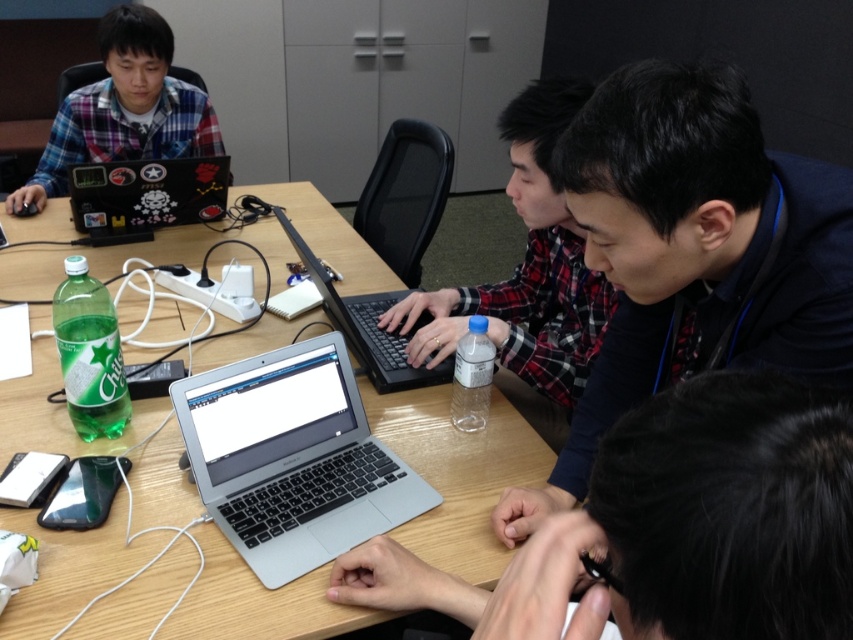
You are sitting at the wooden table at center and want to reach the plaid fabric shirt at center. Is the shirt within arm

The wooden table at center is closer to the viewer than the plaid fabric shirt at center, so the shirt is farther away and may not be within arm

From the picture: You are standing in the middle of the room and want to reach the wooden table at center. In which direction should you move to get there?

Since the wooden table at center is located at point (456, 474) in 2D coordinates, you should move towards the direction where the x and y coordinates increase from your current position to reach it.

You are a person sitting at the wooden table at center. You want to reach for the plaid fabric shirt at center. Can you do so without moving your chair?

The wooden table at center is below the plaid fabric shirt at center, so you can reach it without moving your chair.